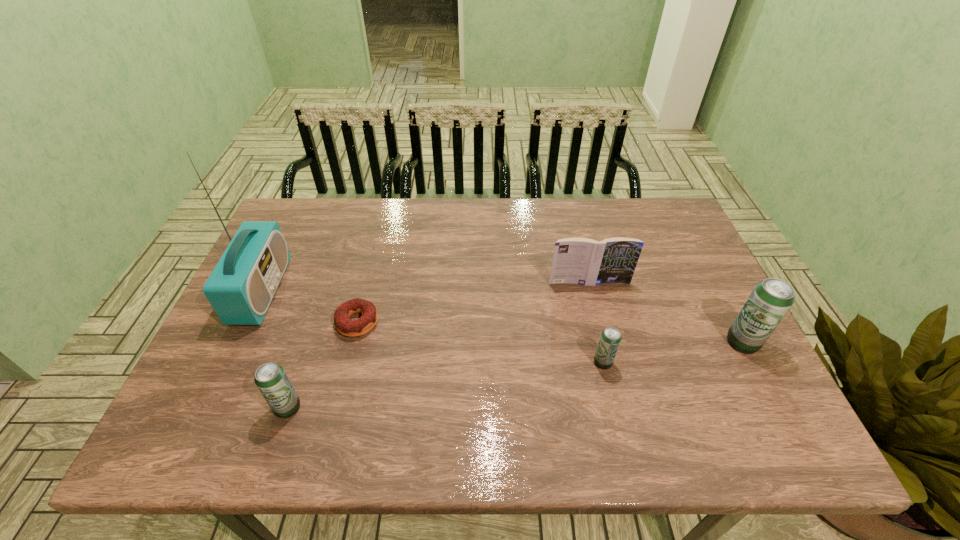
If equal spacing is desired by inserting an extra beer_can among them, please point out a free spot for this new beer_can. Please provide its 2D coordinates. Your answer should be formatted as a tuple, i.e. [(x, y)], where the tuple contains the x and y coordinates of a point satisfying the conditions above.

[(452, 384)]